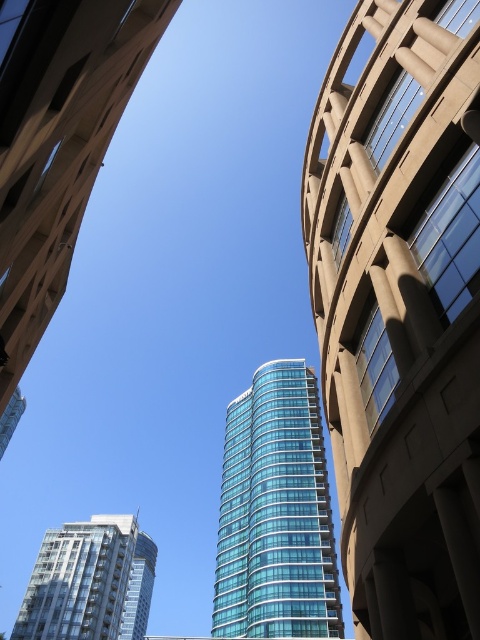
You are standing in the city square and want to take a photo of both the transparent glass tower at upper center and the glassy teal tower at lower left. Which tower should you position yourself closer to in order to capture both in a single frame?

You should position yourself closer to the glassy teal tower at lower left because the transparent glass tower at upper center is closer to the viewer. By moving nearer to the farther tower, you can balance their apparent sizes and fit both into the frame.